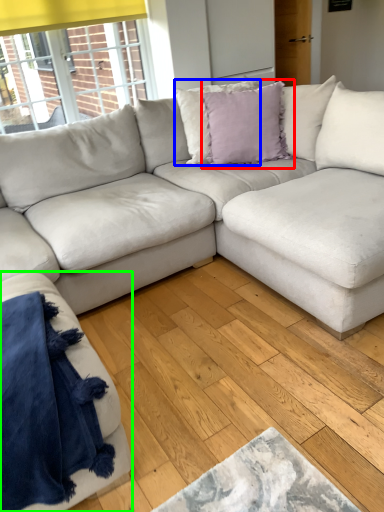
Question: Which object is positioned closest to pillow (highlighted by a red box)? Select from pillow (highlighted by a blue box) and studio couch (highlighted by a green box).

Choices:
 (A) pillow
 (B) studio couch

Answer: (A)